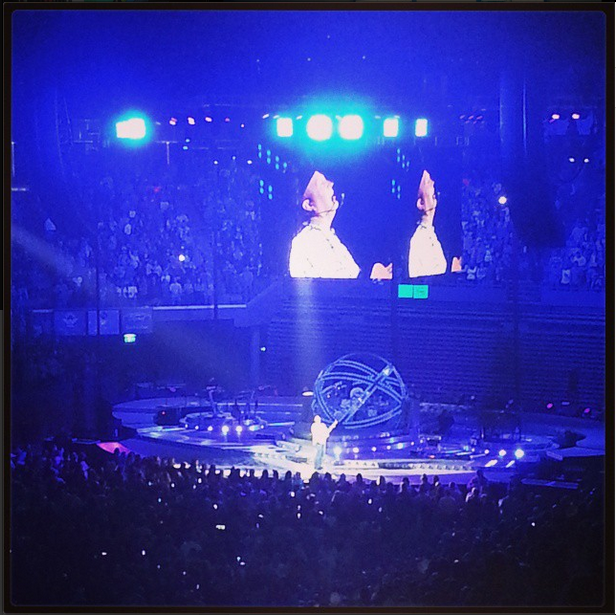
I want to click on wall, so click(434, 347).